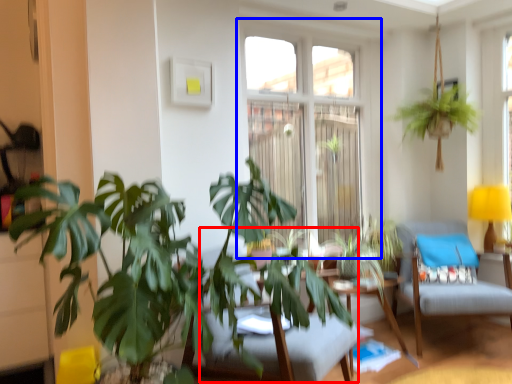
Question: Which point is further to the camera, swivel chair (highlighted by a red box) or window (highlighted by a blue box)?

Choices:
 (A) swivel chair
 (B) window

Answer: (B)